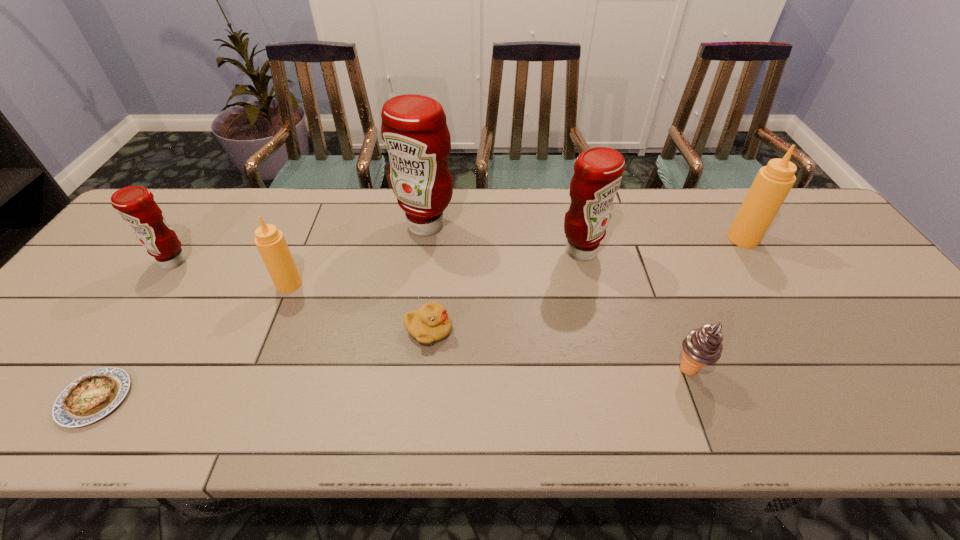
The height and width of the screenshot is (540, 960). I want to click on vacant space located 0.340m on the right of the chocolate icecream, so click(x=860, y=369).

At what (x,y) coordinates should I click in order to perform the action: click on free location located 0.360m on the front-facing side of the yellow duckling. Please return your answer as a coordinate pair (x, y). Looking at the image, I should click on (603, 330).

I want to click on blank space located 0.320m on the right of the shortest object, so click(x=280, y=399).

Where is `object that is at the near edge`? object that is at the near edge is located at coordinates (92, 396).

This screenshot has height=540, width=960. Identify the location of condiment situated at the left edge. coord(136,205).

At what (x,y) coordinates should I click in order to perform the action: click on quiche located in the left edge section of the desktop. Please return your answer as a coordinate pair (x, y). The width and height of the screenshot is (960, 540). Looking at the image, I should click on (92, 396).

You are a GUI agent. You are given a task and a screenshot of the screen. Output one action in this format:
    pyautogui.click(x=<x>, y=<y>)
    Task: Click on the object positioned at the near left corner
    This screenshot has height=540, width=960.
    Given the screenshot: What is the action you would take?
    pyautogui.click(x=92, y=396)

You are a GUI agent. You are given a task and a screenshot of the screen. Output one action in this format:
    pyautogui.click(x=<x>, y=<y>)
    Task: Click on the free space at the far edge
    This screenshot has width=960, height=540.
    Given the screenshot: What is the action you would take?
    pyautogui.click(x=367, y=216)

In the image, there is a desktop. Where is `blank space at the left edge`? The height and width of the screenshot is (540, 960). blank space at the left edge is located at coordinates (114, 265).

In order to click on vacant space at the right edge in this screenshot , I will do `click(834, 281)`.